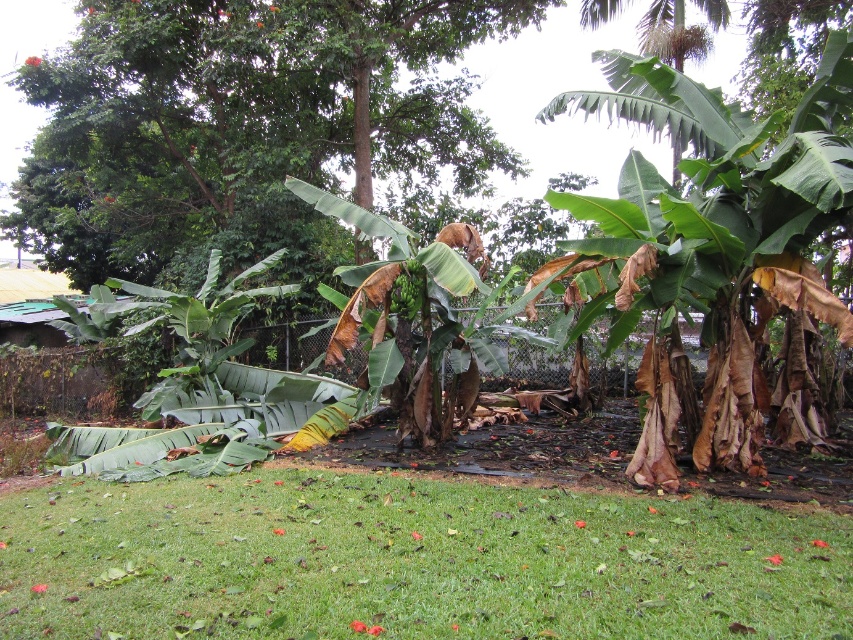
You are a gardener planning to place a decorative stone path between the green leafy banana tree at center and the green matte bananas at center. Based on their widths, which object requires more space to avoid overcrowding?

The green leafy banana tree at center might be wider than green matte bananas at center, so it requires more space to avoid overcrowding.

You are a gardener with a 2.5 meter long ladder. You need to reach the green matte bananas at center to harvest them. The green leafy banana tree at center is blocking your path. Can you safely reach the bananas without climbing the tree?

The distance between the green leafy banana tree at center and the green matte bananas at center is 3.02 meters. Since your ladder is only 2.5 meters long, it is shorter than the required distance. Therefore, you cannot safely reach the bananas without climbing the tree.